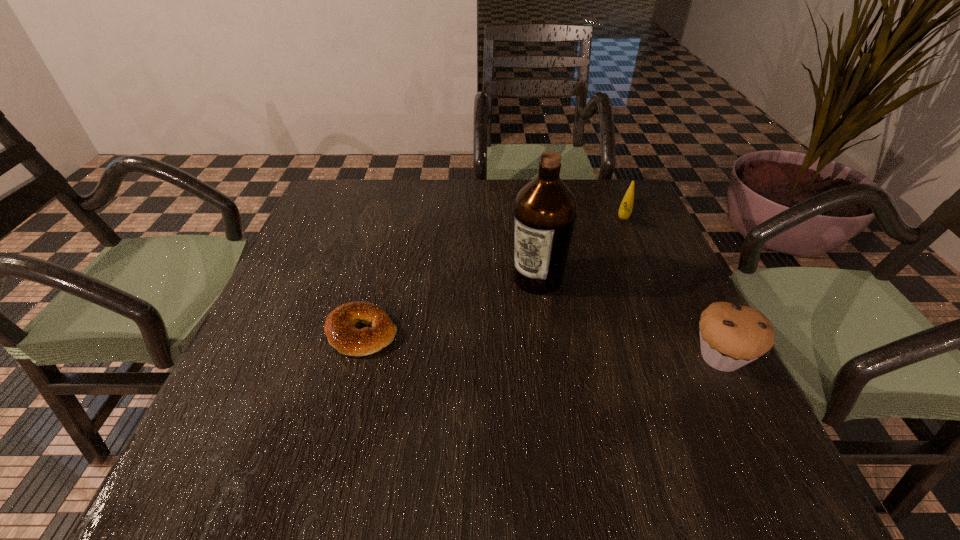
Identify the location of vacant position located at the stem of the banana. This screenshot has width=960, height=540. (615, 268).

Where is `vacant space situated 0.070m at the stem of the banana`? This screenshot has height=540, width=960. vacant space situated 0.070m at the stem of the banana is located at coordinates (621, 247).

Find the location of a particular element. This screenshot has width=960, height=540. free space located 0.180m on the label of the third object from right to left is located at coordinates (480, 349).

Where is `free space located on the label of the third object from right to left`? free space located on the label of the third object from right to left is located at coordinates (420, 423).

The height and width of the screenshot is (540, 960). Identify the location of vacant space located 0.050m on the label of the third object from right to left. (513, 308).

You are a GUI agent. You are given a task and a screenshot of the screen. Output one action in this format:
    pyautogui.click(x=<x>, y=<y>)
    Task: Click on the object positioned at the far edge
    The image size is (960, 540).
    Given the screenshot: What is the action you would take?
    pyautogui.click(x=625, y=210)

The image size is (960, 540). I want to click on object situated at the near edge, so click(x=731, y=335).

Where is `object that is at the left edge`? This screenshot has width=960, height=540. object that is at the left edge is located at coordinates (340, 329).

The image size is (960, 540). What are the coordinates of `muffin at the right edge` in the screenshot? It's located at (731, 335).

The image size is (960, 540). I want to click on banana positioned at the right edge, so point(625,210).